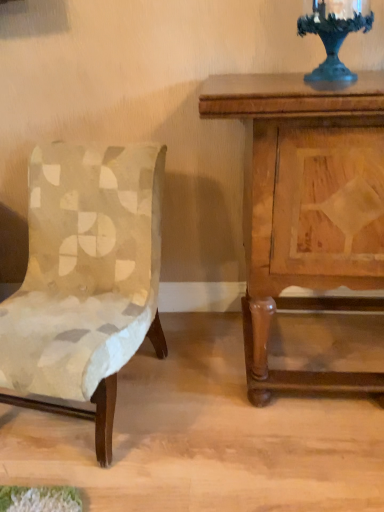
Question: Do you think wooden nightstand at right is within metallic dark blue candle holder at upper right, or outside of it?

Choices:
 (A) inside
 (B) outside

Answer: (B)

Question: Based on their sizes in the image, would you say wooden nightstand at right is bigger or smaller than metallic dark blue candle holder at upper right?

Choices:
 (A) small
 (B) big

Answer: (B)

Question: Based on their relative distances, which object is farther from the wooden nightstand at right?

Choices:
 (A) velvet beige chair at left
 (B) metallic dark blue candle holder at upper right

Answer: (A)

Question: Estimate the real-world distances between objects in this image. Which object is closer to the velvet beige chair at left?

Choices:
 (A) metallic dark blue candle holder at upper right
 (B) wooden nightstand at right

Answer: (B)